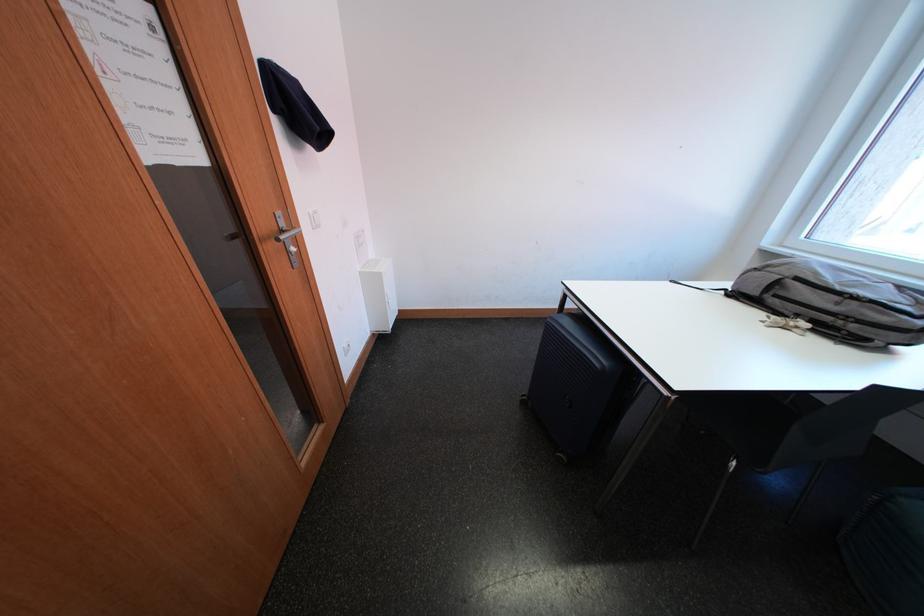
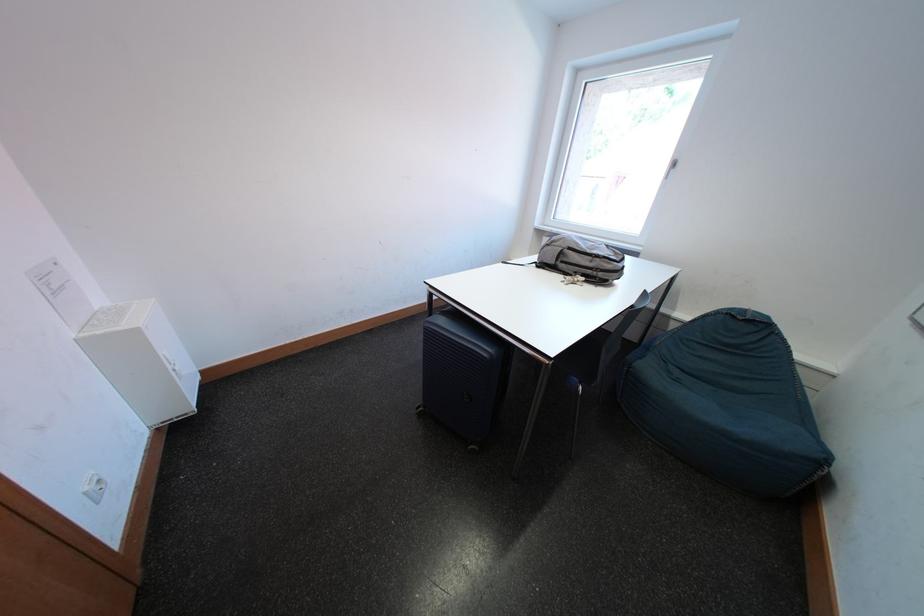
Where in the second image is the point corresponding to point (768, 317) from the first image?

(569, 280)